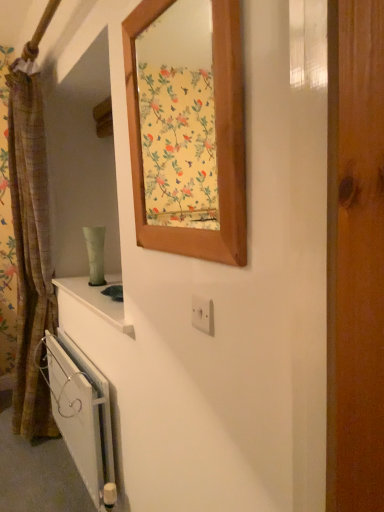
Question: Is brown textured curtain at left aimed at white metallic radiator at lower left?

Choices:
 (A) yes
 (B) no

Answer: (B)

Question: Does brown textured curtain at left have a lesser height compared to white metallic radiator at lower left?

Choices:
 (A) no
 (B) yes

Answer: (A)

Question: Considering the relative positions of brown textured curtain at left and white metallic radiator at lower left in the image provided, is brown textured curtain at left behind white metallic radiator at lower left?

Choices:
 (A) no
 (B) yes

Answer: (B)

Question: From the image's perspective, is brown textured curtain at left located beneath white metallic radiator at lower left?

Choices:
 (A) yes
 (B) no

Answer: (B)

Question: Does brown textured curtain at left appear on the left side of white metallic radiator at lower left?

Choices:
 (A) yes
 (B) no

Answer: (A)

Question: From a real-world perspective, is brown textured curtain at left positioned under white metallic radiator at lower left based on gravity?

Choices:
 (A) yes
 (B) no

Answer: (B)

Question: Does wooden frame at upper center appear on the right side of brown textured curtain at left?

Choices:
 (A) no
 (B) yes

Answer: (B)

Question: Does wooden frame at upper center have a lesser width compared to brown textured curtain at left?

Choices:
 (A) yes
 (B) no

Answer: (A)

Question: Is brown textured curtain at left inside wooden frame at upper center?

Choices:
 (A) yes
 (B) no

Answer: (B)

Question: Does wooden frame at upper center have a greater width compared to brown textured curtain at left?

Choices:
 (A) yes
 (B) no

Answer: (B)

Question: Is wooden frame at upper center taller than brown textured curtain at left?

Choices:
 (A) no
 (B) yes

Answer: (A)

Question: Is wooden frame at upper center touching brown textured curtain at left?

Choices:
 (A) no
 (B) yes

Answer: (A)

Question: Is wooden frame at upper center far away from white metallic radiator at lower left?

Choices:
 (A) yes
 (B) no

Answer: (A)